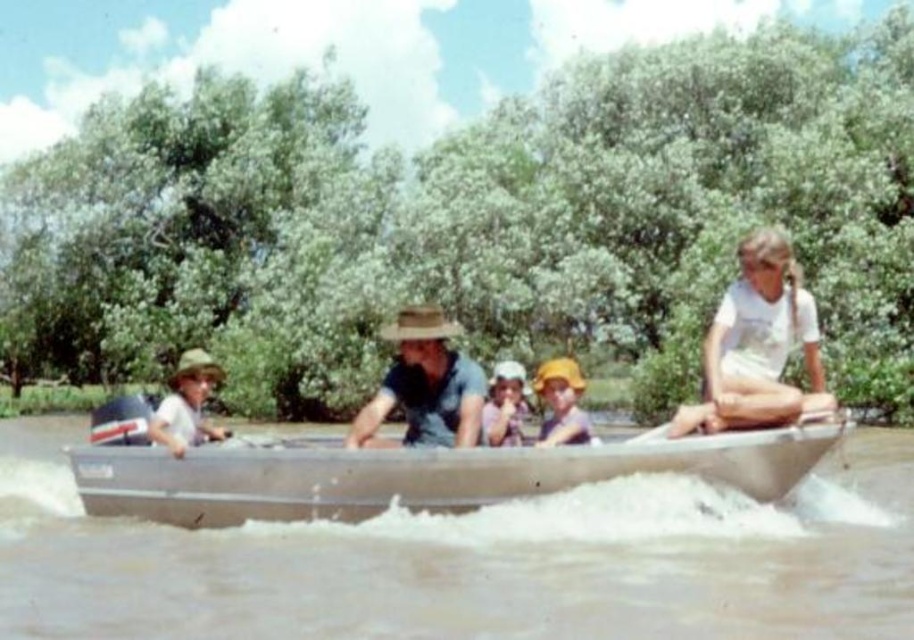
Question: Is brushed metal boat at center below pink fabric hat at center?

Choices:
 (A) yes
 (B) no

Answer: (A)

Question: Among these points, which one is farthest from the camera?

Choices:
 (A) (404, 314)
 (B) (444, 602)

Answer: (A)

Question: Among these objects, which one is nearest to the camera?

Choices:
 (A) pink fabric hat at center
 (B) white cotton shirt at right

Answer: (B)

Question: Does white cotton shirt at right have a greater width compared to brown woven hat at center?

Choices:
 (A) no
 (B) yes

Answer: (B)

Question: Does silver metallic boat at center have a lesser width compared to white cotton shirt at right?

Choices:
 (A) yes
 (B) no

Answer: (B)

Question: Which object is positioned farthest from the silver metallic boat at center?

Choices:
 (A) brushed metal boat at center
 (B) white cotton shirt at right
 (C) brown woven hat at center
 (D) pink fabric hat at center

Answer: (B)